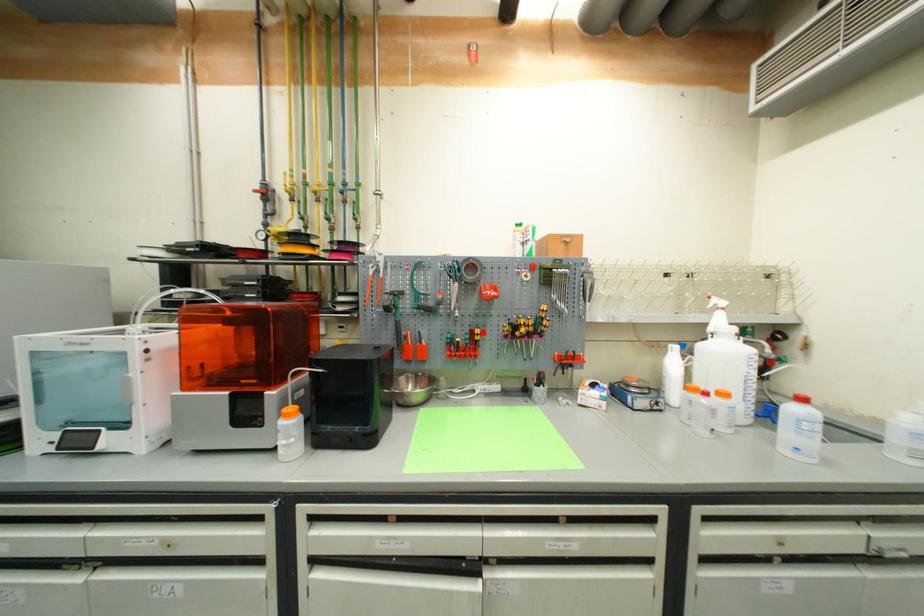
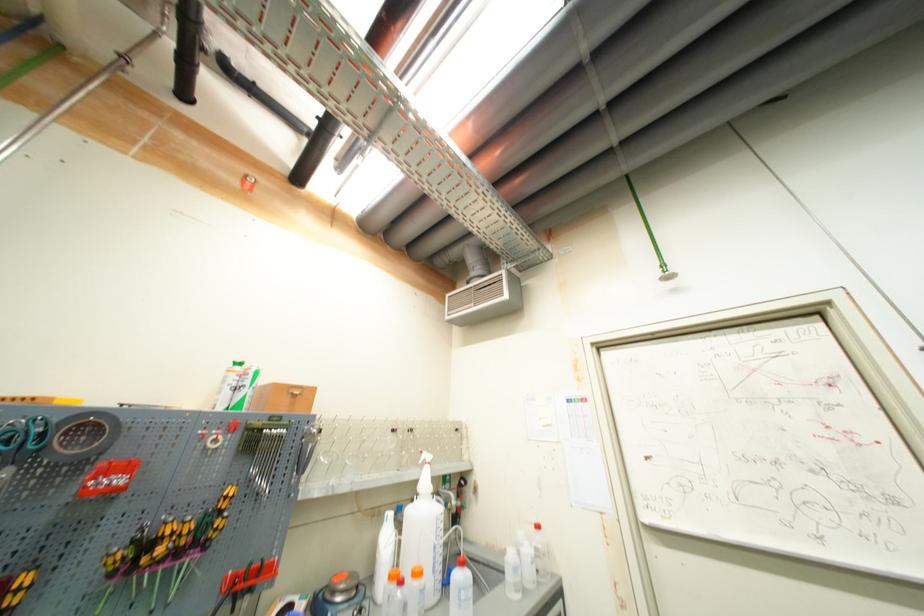
Question: I am providing you with two images of the same scene from different viewpoints. In image1, a red point is highlighted. Considering the same 3D point in image2, which of the following is correct?

Choices:
 (A) It is closer
 (B) It is farther

Answer: (A)